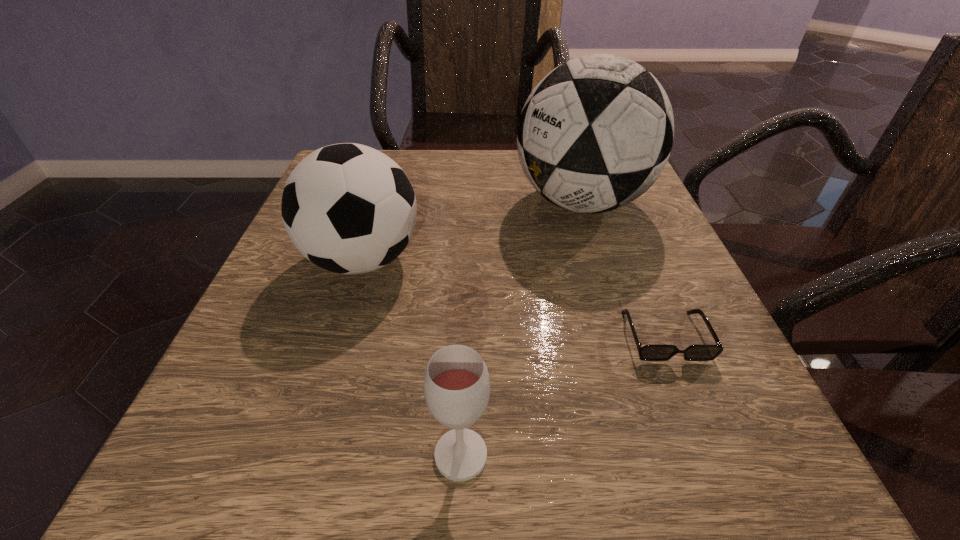
Where is `vacant area that lies between the nearest object and the third shortest object`? Image resolution: width=960 pixels, height=540 pixels. vacant area that lies between the nearest object and the third shortest object is located at coordinates (412, 357).

The height and width of the screenshot is (540, 960). I want to click on vacant space that's between the left soccer ball and the second nearest object, so click(514, 298).

What are the coordinates of `empty location between the shortest object and the taller soccer ball` in the screenshot? It's located at (623, 269).

Locate an element on the screen. vacant space in between the second nearest object and the right soccer ball is located at coordinates (623, 269).

Find the location of a particular element. This screenshot has width=960, height=540. object that can be found as the second closest to the right soccer ball is located at coordinates (348, 208).

The image size is (960, 540). I want to click on object that stands as the third closest to the taller soccer ball, so click(x=456, y=384).

In order to click on free location that satisfies the following two spatial constraints: 1. on the surface of the tallest object where the brand logo is visible; 2. on the front side of the nearest object in this screenshot , I will do `click(660, 455)`.

This screenshot has width=960, height=540. In order to click on free spot that satisfies the following two spatial constraints: 1. on the surface of the tallest object where the brand logo is visible; 2. on the front side of the second shortest object in this screenshot , I will do coord(660,455).